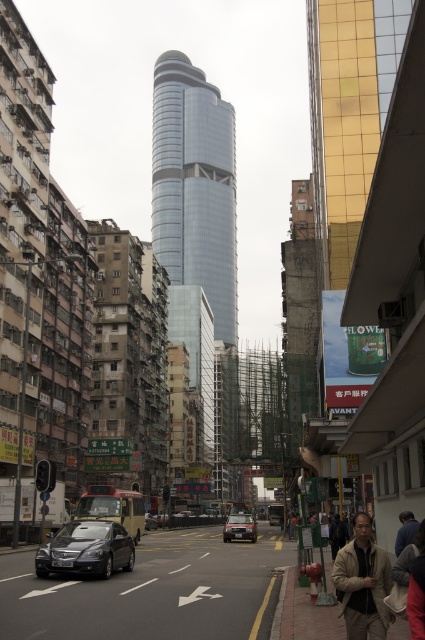
Does shiny glass tower at center appear over beige fabric jacket at lower right?

Correct, shiny glass tower at center is located above beige fabric jacket at lower right.

This screenshot has height=640, width=425. Find the location of `shiny glass tower at center`. shiny glass tower at center is located at coordinates (195, 186).

Is point (184, 116) positioned before point (360, 540)?

No, (184, 116) is further to viewer.

Where is `shiny glass tower at center`? The image size is (425, 640). shiny glass tower at center is located at coordinates (195, 186).

Who is shorter, beige fabric jacket at lower right or shiny black sedan at lower left?

With less height is beige fabric jacket at lower right.

Between beige fabric jacket at lower right and shiny black sedan at lower left, which one appears on the right side from the viewer's perspective?

beige fabric jacket at lower right is more to the right.

Is point (367, 586) positioned after point (107, 545)?

No.

Image resolution: width=425 pixels, height=640 pixels. What are the coordinates of `beige fabric jacket at lower right` in the screenshot? It's located at (362, 582).

Can you confirm if blue fabric shirt at lower right is taller than matte black car at center?

In fact, blue fabric shirt at lower right may be shorter than matte black car at center.

Who is positioned more to the left, blue fabric shirt at lower right or matte black car at center?

matte black car at center is more to the left.

Image resolution: width=425 pixels, height=640 pixels. What do you see at coordinates (405, 531) in the screenshot?
I see `blue fabric shirt at lower right` at bounding box center [405, 531].

I want to click on blue fabric shirt at lower right, so click(x=405, y=531).